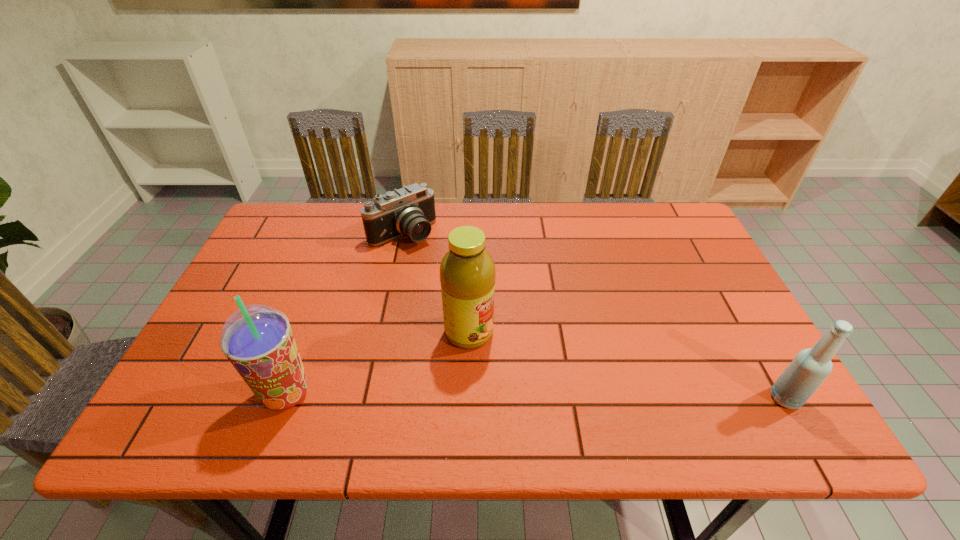
In order to click on free location at the far edge of the desktop in this screenshot , I will do `click(353, 225)`.

The width and height of the screenshot is (960, 540). In order to click on free space at the near edge of the desktop in this screenshot , I will do `click(662, 397)`.

I want to click on vacant space at the left edge of the desktop, so click(x=277, y=266).

At what (x,y) coordinates should I click in order to perform the action: click on free point at the right edge. Please return your answer as a coordinate pair (x, y). The height and width of the screenshot is (540, 960). Looking at the image, I should click on (660, 263).

Where is `free space at the far left corner`? The image size is (960, 540). free space at the far left corner is located at coordinates (287, 235).

Identify the location of free point at the near right corner. (767, 370).

Identify the location of vacant area that lies between the second object from right to left and the third object from right to left. (436, 283).

Locate an element on the screen. empty location between the bottle and the third nearest object is located at coordinates (627, 365).

The width and height of the screenshot is (960, 540). In order to click on unoccupied position between the bottle and the leftmost object in this screenshot , I will do `click(536, 396)`.

Image resolution: width=960 pixels, height=540 pixels. In order to click on free space that is in between the third tallest object and the smoothie in this screenshot , I will do `click(536, 396)`.